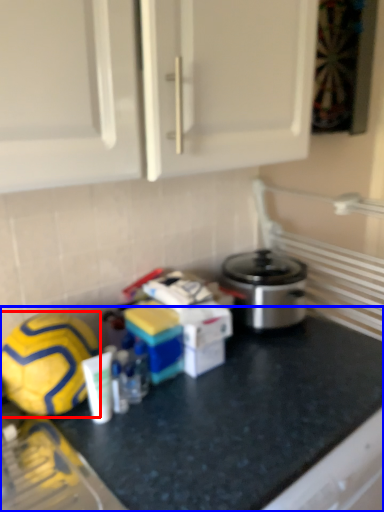
Question: Which point is further to the camera, football (highlighted by a red box) or counter (highlighted by a blue box)?

Choices:
 (A) football
 (B) counter

Answer: (A)